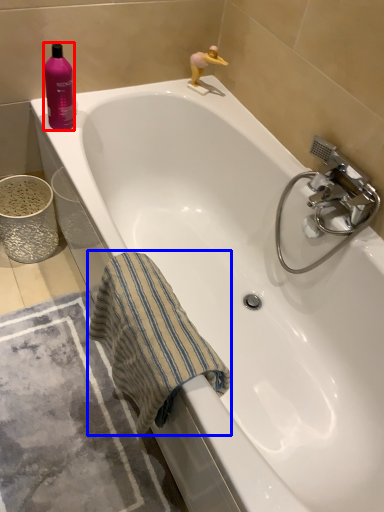
Question: Which object is closer to the camera taking this photo, cleaning product (highlighted by a red box) or beach towel (highlighted by a blue box)?

Choices:
 (A) cleaning product
 (B) beach towel

Answer: (B)